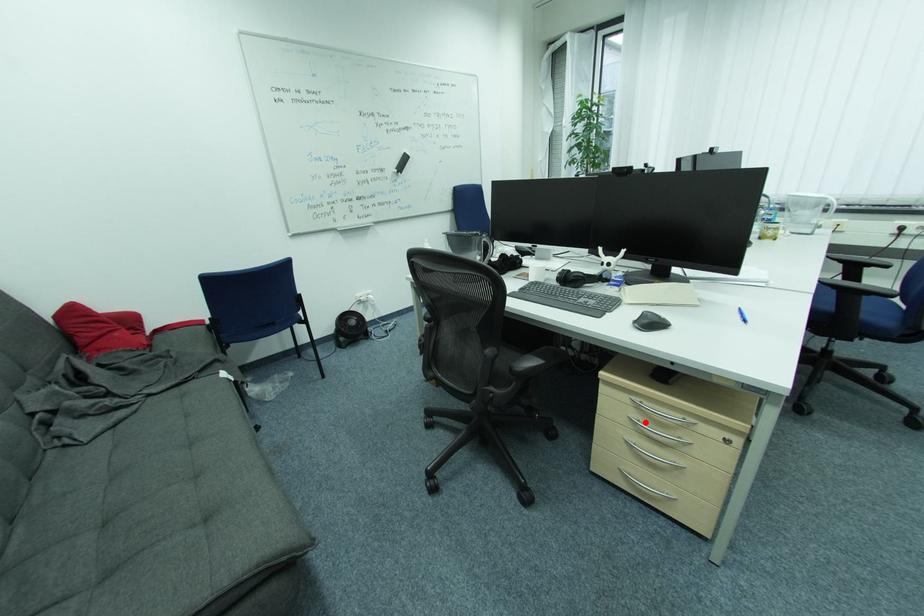
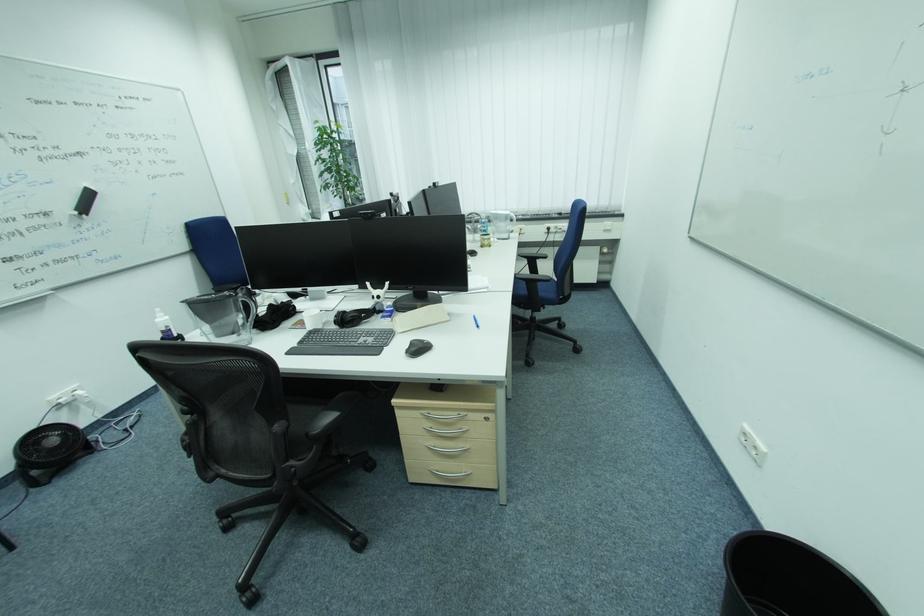
Where in the second image is the point corresponding to the highlighted location from the first image?

(438, 429)